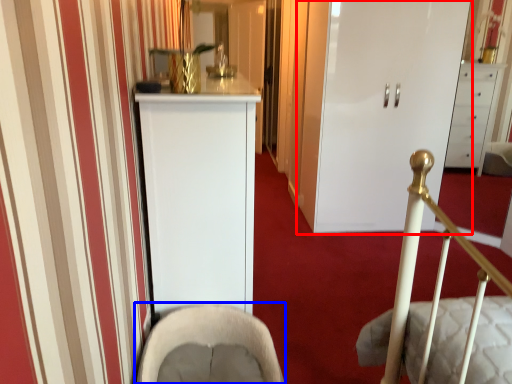
Question: Which object appears closest to the camera in this image, door (highlighted by a red box) or rocking chair (highlighted by a blue box)?

Choices:
 (A) door
 (B) rocking chair

Answer: (B)